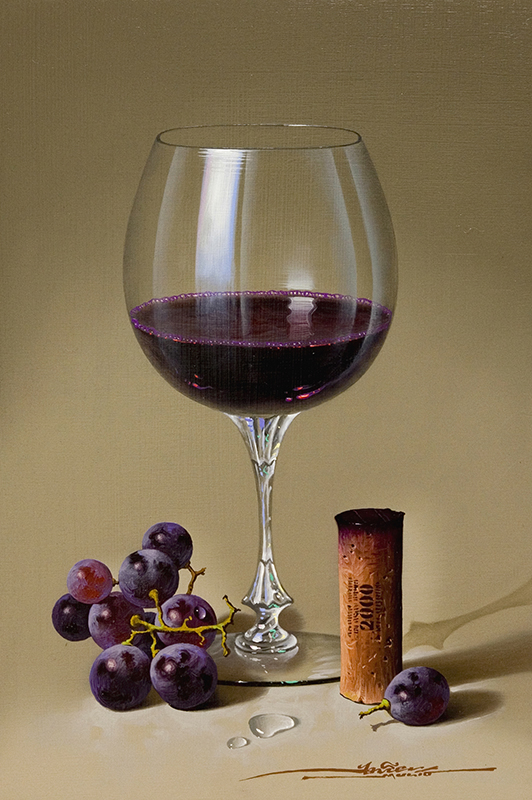
I want to click on wine glass, so click(243, 240).